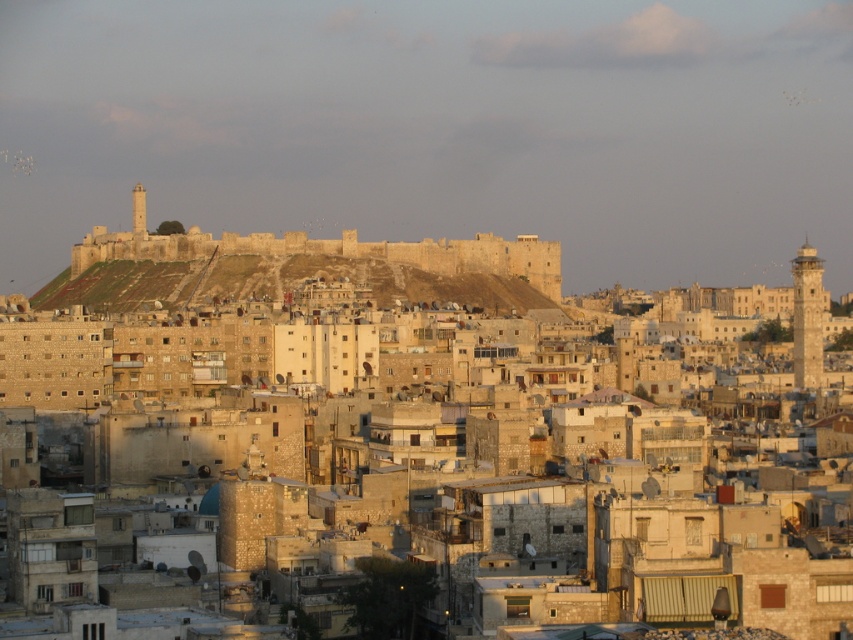
Which is behind, point (332, 381) or point (546, 262)?

Point (546, 262)

Is beige stone buildings at center thinner than stone fortress at center?

No, beige stone buildings at center is not thinner than stone fortress at center.

Does point (15, 362) lie in front of point (519, 260)?

Yes, point (15, 362) is in front of point (519, 260).

I want to click on beige stone buildings at center, so click(x=804, y=337).